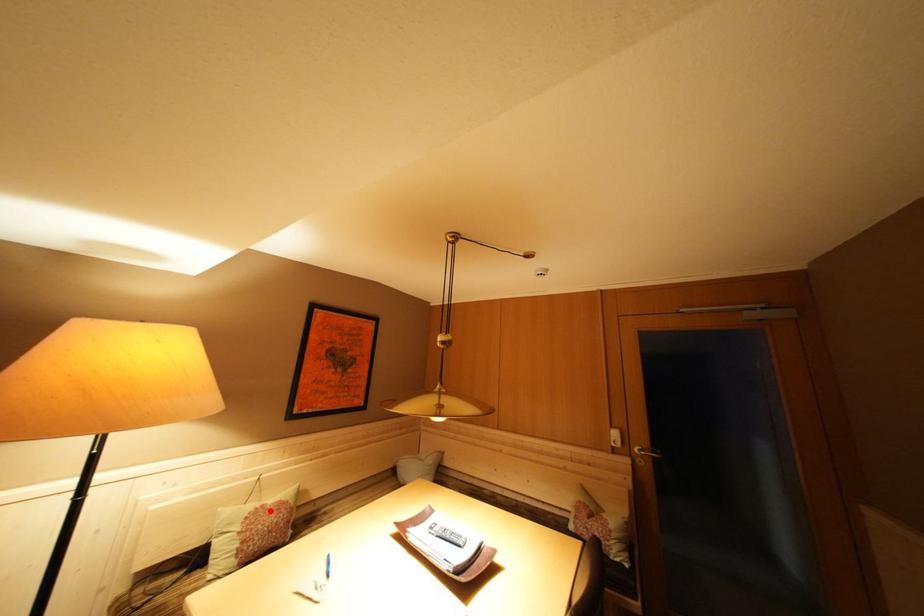
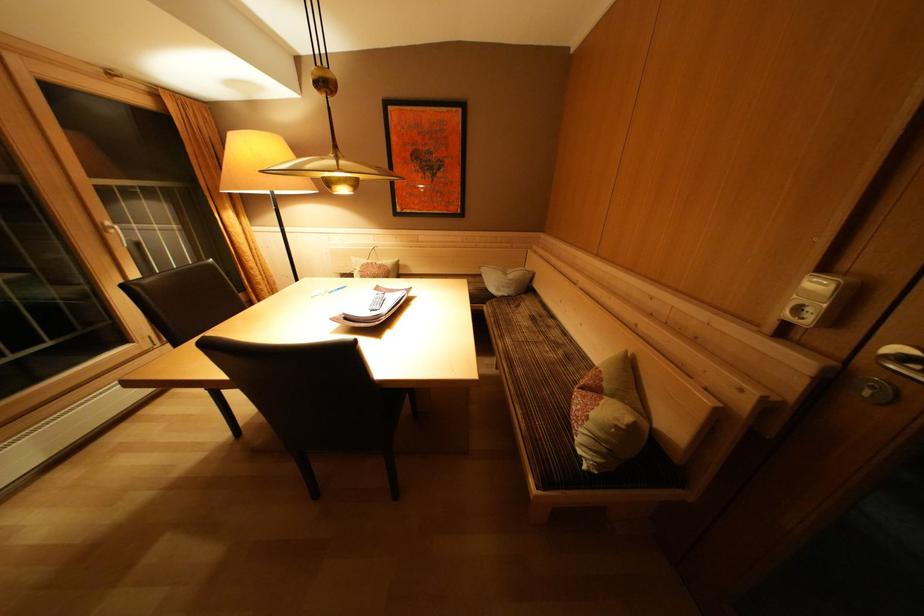
Question: A red point is marked in image1. In image2, is the corresponding 3D point closer to the camera or farther? Reply with the corresponding letter.

Choices:
 (A) The corresponding 3D point is closer.
 (B) The corresponding 3D point is farther.

Answer: (A)